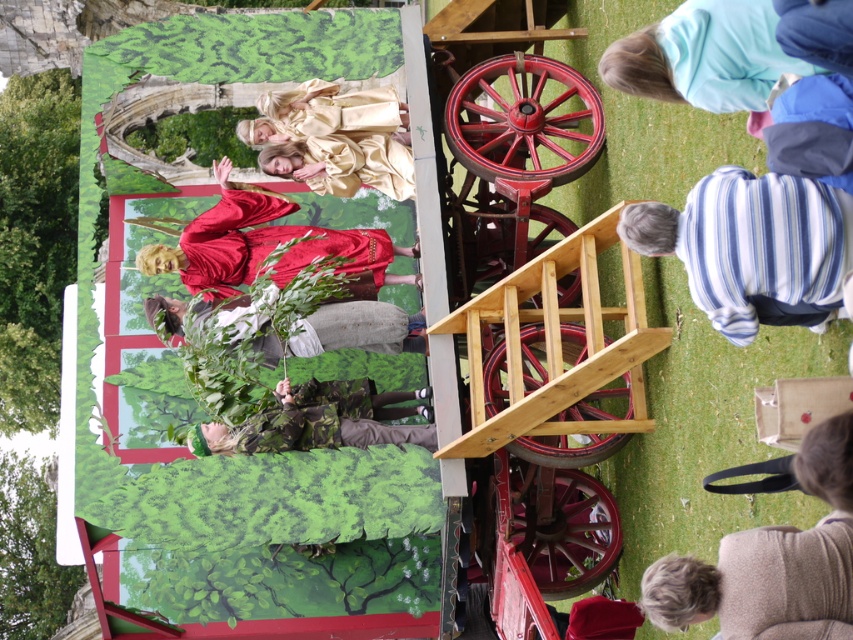
You are a photographer positioned at the front of the stage. You want to take a photo where both the point at position (724, 308) and the point at position (376, 234) are in focus. Considering their distances from the camera, which point should you focus on to ensure both are sharp?

You should focus on point (376, 234) because it is farther from the camera than point (724, 308). By focusing on the farther point, the depth of field will include the closer point as well, ensuring both are in focus.

You are a stagehand who needs to move a 2.5 meter long ladder from the gray wool sweater at lower right to the matte red robe at center. Can you move the ladder without bending it? Please explain your reasoning based on the distance between them.

The gray wool sweater at lower right and matte red robe at center are 24.88 meters apart. Since the ladder is only 2.5 meters long, the distance between them is much greater than the ladder length. Therefore, you cannot move the ladder straight between them without bending it.